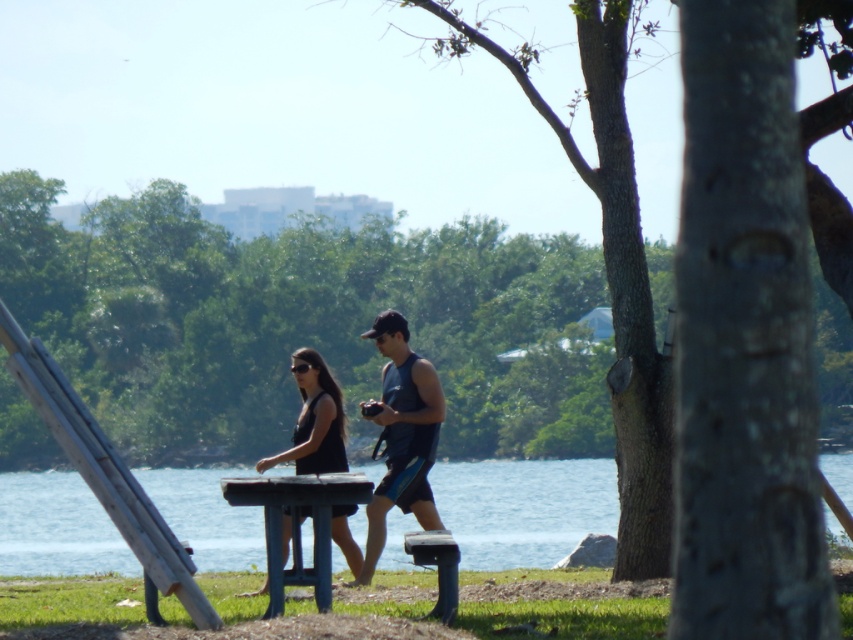
You are a photographer trying to capture a photo of the dark blue tank top at center and the blue water at center. Which object should you focus on first if you want the other to be slightly out of focus?

The blue water at center is below dark blue tank top at center, so you should focus on the dark blue tank top at center first to have the blue water at center slightly out of focus.

You are planning to sit on the wooden park bench at center while wearing your black matte dress at center. Considering the dress might spread out, will the bench be wide enough to accommodate both you and your dress comfortably?

The black matte dress at center is wider than the wooden park bench at center, so the bench may not be wide enough to accommodate both you and your dress comfortably.